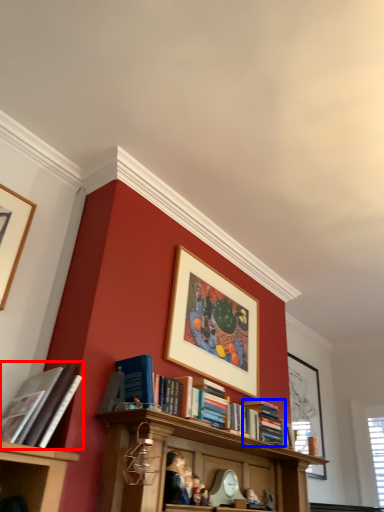
Question: Which point is further to the camera, book (highlighted by a red box) or book (highlighted by a blue box)?

Choices:
 (A) book
 (B) book

Answer: (B)